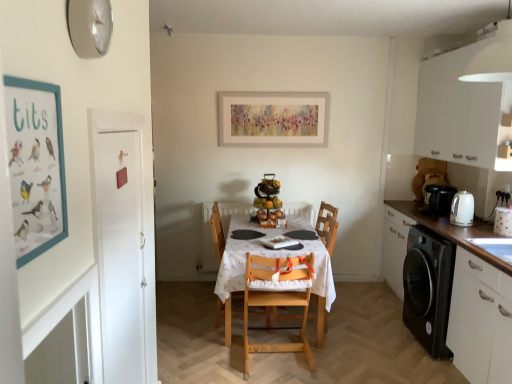
Where is `free space to the right of white glossy electric kettle at right, positioned as the 2th appliance in right-to-left order`? free space to the right of white glossy electric kettle at right, positioned as the 2th appliance in right-to-left order is located at coordinates (483, 226).